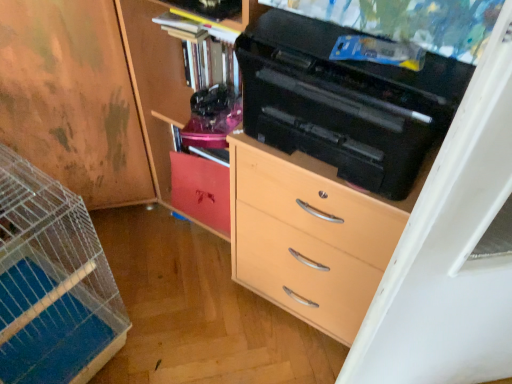
Identify the location of free space in front of matte wood cabinet at center, placed as the 2th cabinetry when sorted from left to right. This screenshot has height=384, width=512. (196, 260).